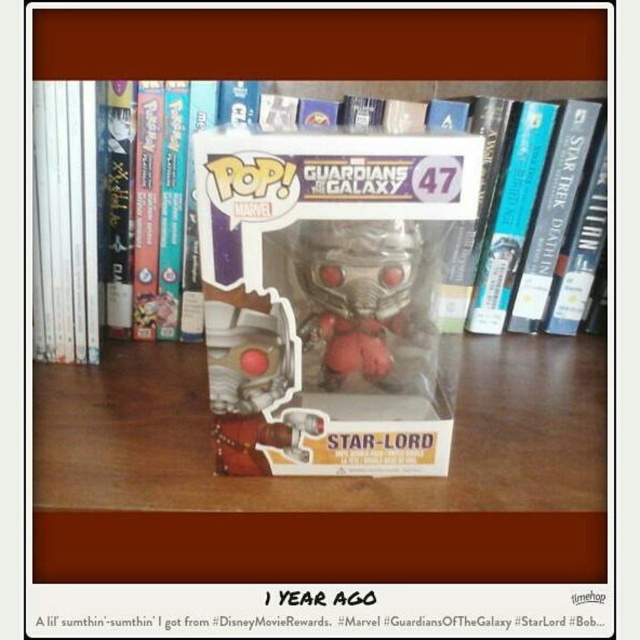
Question: Which of these objects is positioned closest to the clear plastic pop vinyl figure at center?

Choices:
 (A) metallic silver helmet at center
 (B) wooden table at center
 (C) clear plastic box at center

Answer: (B)

Question: Is clear plastic pop vinyl figure at center below metallic silver helmet at center?

Choices:
 (A) no
 (B) yes

Answer: (A)

Question: Considering the real-world distances, which object is closest to the metallic silver helmet at center?

Choices:
 (A) clear plastic pop vinyl figure at center
 (B) clear plastic box at center
 (C) wooden table at center

Answer: (B)

Question: Which of the following is the farthest from the observer?

Choices:
 (A) clear plastic pop vinyl figure at center
 (B) metallic silver helmet at center

Answer: (A)

Question: Can you confirm if clear plastic pop vinyl figure at center is positioned above metallic silver helmet at center?

Choices:
 (A) yes
 (B) no

Answer: (A)

Question: Does wooden table at center appear on the left side of clear plastic box at center?

Choices:
 (A) no
 (B) yes

Answer: (A)